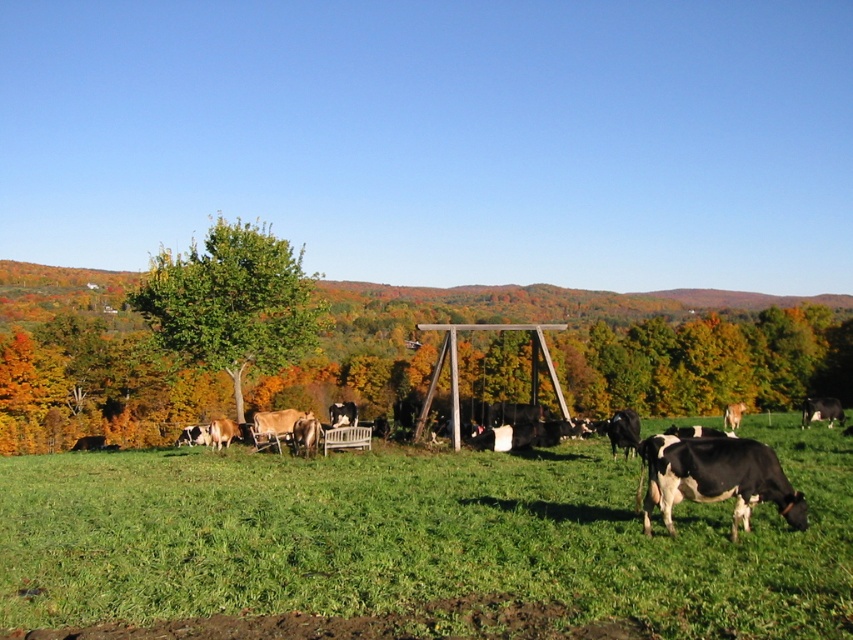
Question: Which point is farther to the camera?

Choices:
 (A) black and white cow at center
 (B) black glossy cow at lower right
 (C) black and white cow at right

Answer: (C)

Question: Based on their relative distances, which object is nearer to the black and white cow at right?

Choices:
 (A) black glossy cow at lower right
 (B) green grassy field at center
 (C) black and white cow at center
 (D) green leafy tree at center

Answer: (B)

Question: Does green leafy tree at center appear under black and white cow at right?

Choices:
 (A) no
 (B) yes

Answer: (A)

Question: Is green grassy field at center to the right of black and white cow at right from the viewer's perspective?

Choices:
 (A) yes
 (B) no

Answer: (B)

Question: Which point appears closest to the camera in this image?

Choices:
 (A) (715, 444)
 (B) (190, 360)

Answer: (A)

Question: Observing the image, what is the correct spatial positioning of black glossy cow at lower right in reference to black and white cow at center?

Choices:
 (A) above
 (B) below

Answer: (A)